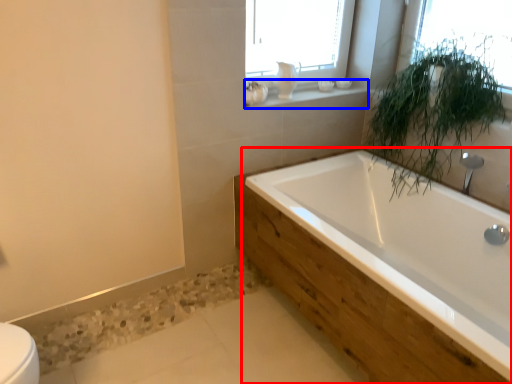
Question: Which object appears closest to the camera in this image, bathtub (highlighted by a red box) or window sill (highlighted by a blue box)?

Choices:
 (A) bathtub
 (B) window sill

Answer: (A)